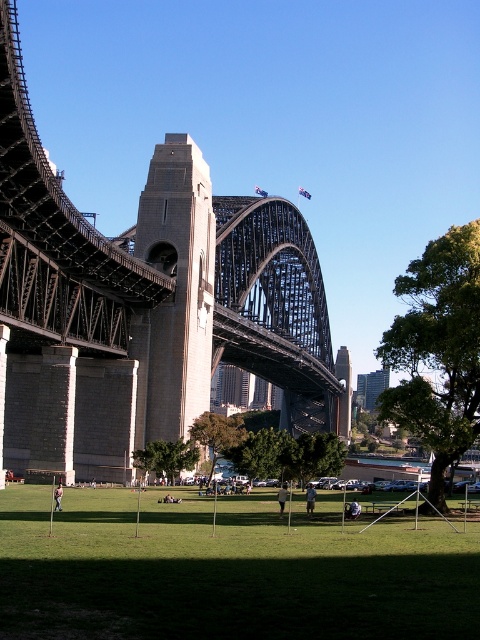
Question: Does light brown fabric shirt at center appear on the left side of light brown wooden stick at center?

Choices:
 (A) no
 (B) yes

Answer: (A)

Question: Does dark gray steel bridge at center have a greater width compared to green grass at center?

Choices:
 (A) no
 (B) yes

Answer: (B)

Question: Is dark gray steel bridge at center to the right of green grass at center from the viewer's perspective?

Choices:
 (A) no
 (B) yes

Answer: (A)

Question: Which object is closer to the camera taking this photo?

Choices:
 (A) light brown fabric shirt at center
 (B) white cotton shirt at center

Answer: (A)

Question: Which point appears closest to the camera in this image?

Choices:
 (A) (282, 497)
 (B) (157, 280)
 (C) (0, 609)

Answer: (C)

Question: Which object is the farthest from the white cotton shirt at center?

Choices:
 (A) light brown wooden stick at center
 (B) dark blue jeans at center

Answer: (A)